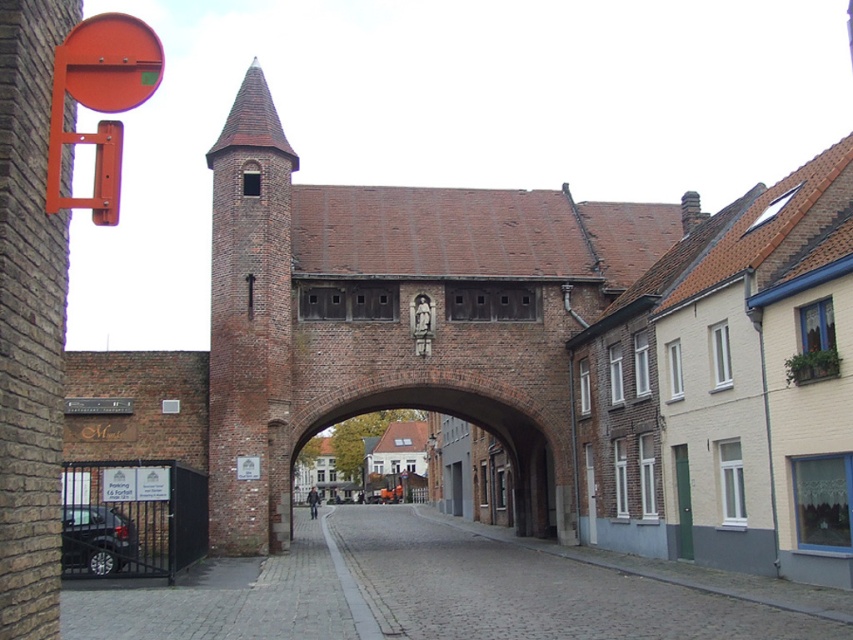
Can you confirm if brown brick tower at center-left is shorter than brick archway at center?

No, brown brick tower at center-left is not shorter than brick archway at center.

Which is below, brown brick tower at center-left or brick archway at center?

brick archway at center

Is point (262, 244) behind point (531, 529)?

That is False.

This screenshot has height=640, width=853. Identify the location of brown brick tower at center-left. [250, 326].

Is cobblestone alley at lower left to the right of brick archway at center from the viewer's perspective?

No, cobblestone alley at lower left is not to the right of brick archway at center.

Find the location of a particular element. The height and width of the screenshot is (640, 853). cobblestone alley at lower left is located at coordinates (421, 593).

Measure the distance between cobblestone alley at lower left and camera.

They are 32.56 meters apart.

The height and width of the screenshot is (640, 853). Find the location of `cobblestone alley at lower left`. cobblestone alley at lower left is located at coordinates (421, 593).

Which is more to the left, cobblestone alley at lower left or orange painted metal sign at upper left?

orange painted metal sign at upper left is more to the left.

Between point (430, 580) and point (111, 138), which one is positioned behind?

Positioned behind is point (430, 580).

Identify the location of cobblestone alley at lower left. (421, 593).